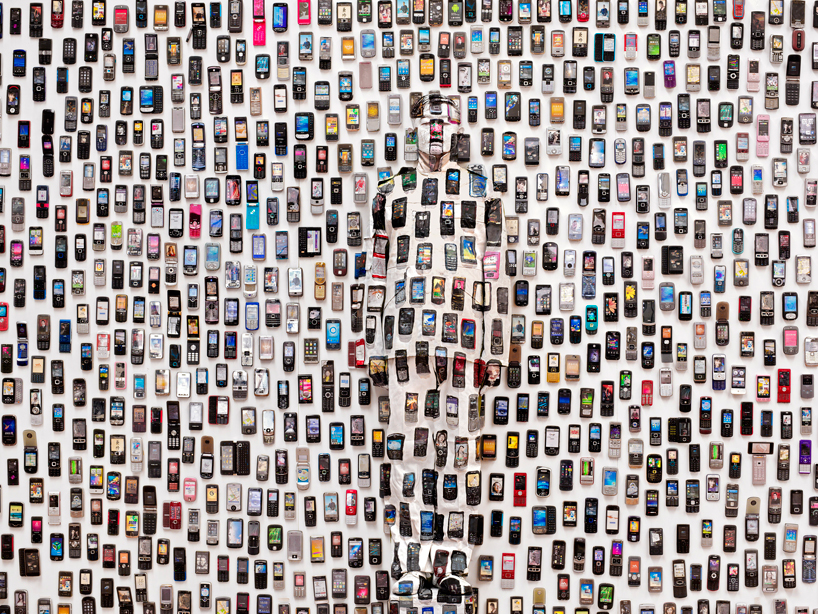
Where is `phone`? phone is located at coordinates (x=356, y=552).